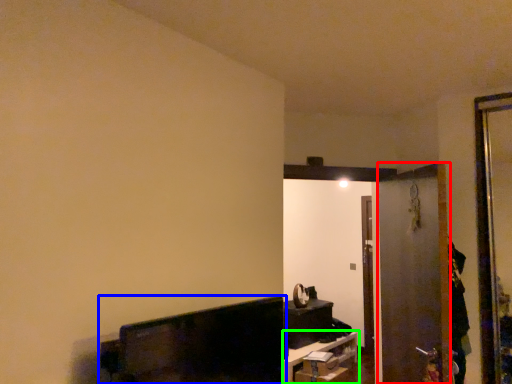
Question: Which object is positioned closest to screen door (highlighted by a red box)? Select from furniture (highlighted by a blue box) and furniture (highlighted by a green box).

Choices:
 (A) furniture
 (B) furniture

Answer: (A)